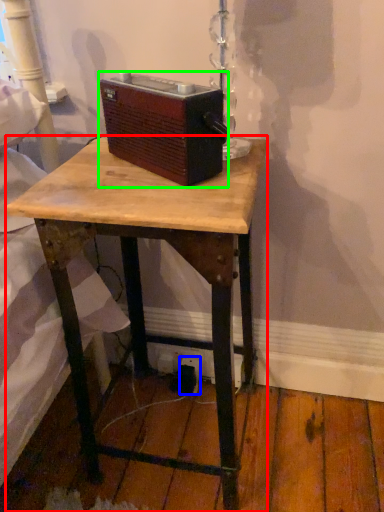
Question: Estimate the real-world distances between objects in this image. Which object is closer to desk (highlighted by a red box), electric outlet (highlighted by a blue box) or gadget (highlighted by a green box)?

Choices:
 (A) electric outlet
 (B) gadget

Answer: (B)